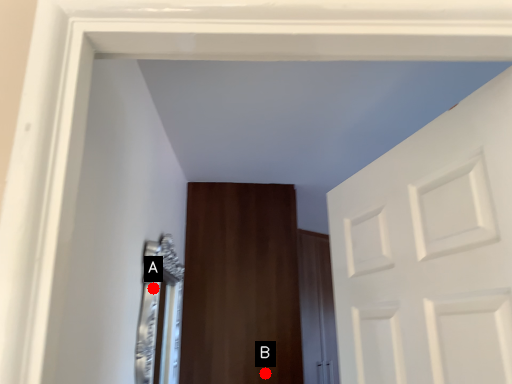
Question: Two points are circled on the image, labeled by A and B beside each circle. Which point is farther to the camera?

Choices:
 (A) A is further
 (B) B is further

Answer: (B)